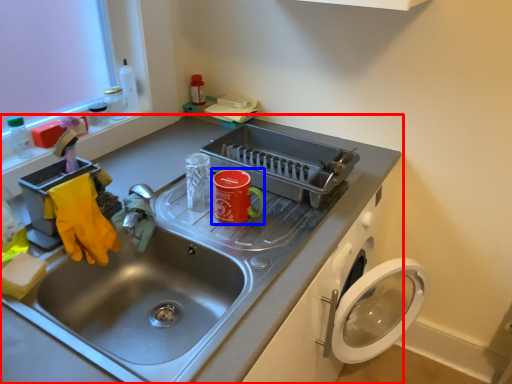
Question: Which of the following is the closest to the observer, sink (highlighted by a red box) or appliance (highlighted by a blue box)?

Choices:
 (A) sink
 (B) appliance

Answer: (A)